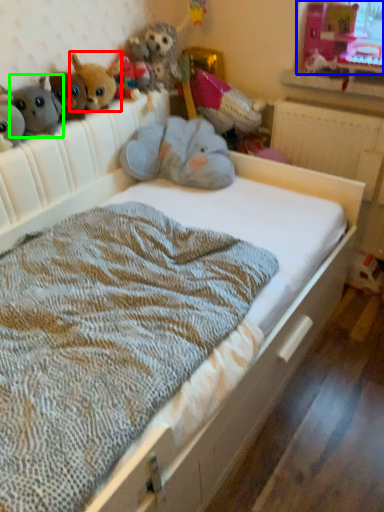
Question: Considering the real-world distances, which object is closest to toy (highlighted by a red box)? window screen (highlighted by a blue box) or toy (highlighted by a green box).

Choices:
 (A) window screen
 (B) toy

Answer: (B)